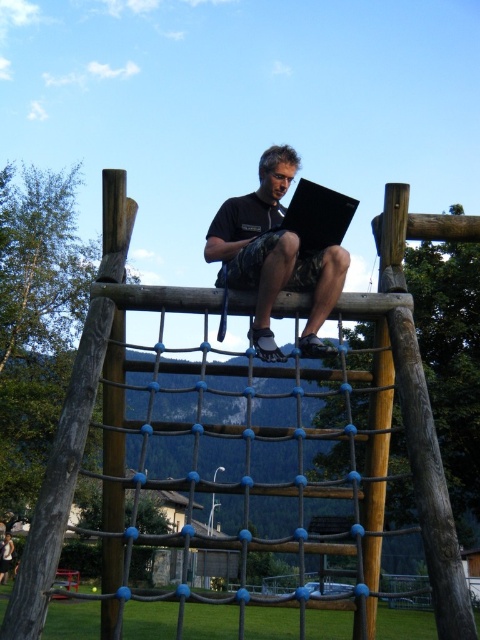
Question: In this image, where is brown wooden rope bridge at center located relative to matte black laptop at center?

Choices:
 (A) right
 (B) left

Answer: (B)

Question: Can you confirm if matte black laptop at center is positioned to the right of black matte laptop at center?

Choices:
 (A) yes
 (B) no

Answer: (B)

Question: Which object appears farthest from the camera in this image?

Choices:
 (A) black matte laptop at center
 (B) matte black laptop at center
 (C) brown wooden rope bridge at center

Answer: (B)

Question: Is brown wooden rope bridge at center to the right of matte black laptop at center from the viewer's perspective?

Choices:
 (A) yes
 (B) no

Answer: (B)

Question: Which object is positioned closest to the black matte laptop at center?

Choices:
 (A) matte black laptop at center
 (B) brown wooden rope bridge at center

Answer: (A)

Question: Which of the following is the farthest from the observer?

Choices:
 (A) (324, 372)
 (B) (257, 321)
 (C) (328, 230)

Answer: (A)